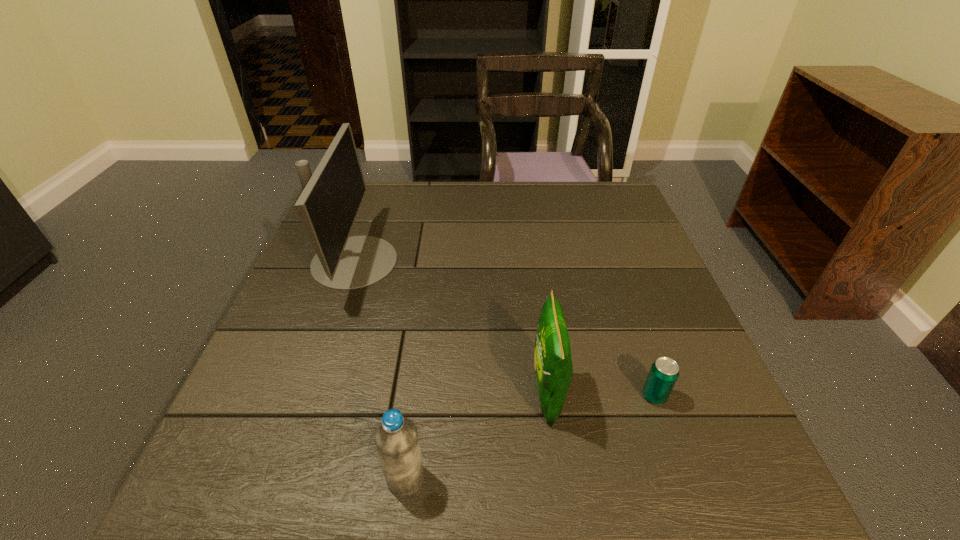
At what (x,y) coordinates should I click in order to perform the action: click on vacant space situated 0.280m on the front-facing side of the crisp (potato chip). Please return your answer as a coordinate pair (x, y). This screenshot has width=960, height=540. Looking at the image, I should click on (386, 394).

Identify the location of free space located 0.320m on the back of the nearest object. (425, 322).

What are the coordinates of `vacant region located 0.050m on the back of the shortest object` in the screenshot? It's located at (643, 365).

This screenshot has width=960, height=540. I want to click on object at the far edge, so click(328, 206).

Identify the location of object present at the near edge. This screenshot has height=540, width=960. (396, 439).

This screenshot has height=540, width=960. I want to click on object positioned at the left edge, so click(x=328, y=206).

I want to click on object at the right edge, so click(664, 372).

Identify the location of object located at the far left corner. The width and height of the screenshot is (960, 540). (328, 206).

At what (x,y) coordinates should I click in order to perform the action: click on vacant space at the far edge of the desktop. Please return your answer as a coordinate pair (x, y). The height and width of the screenshot is (540, 960). Looking at the image, I should click on (426, 220).

The image size is (960, 540). In order to click on free space at the near edge of the desktop in this screenshot , I will do `click(315, 472)`.